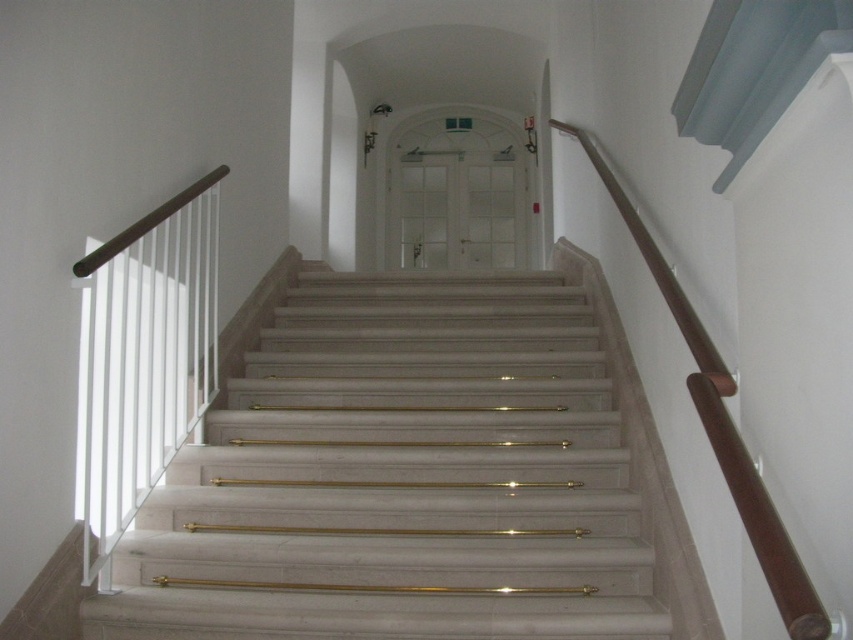
Question: Where is white marble stairs at center located in relation to brown polished wood handrail at upper right in the image?

Choices:
 (A) below
 (B) above

Answer: (A)

Question: Which point is closer to the camera taking this photo?

Choices:
 (A) (498, 440)
 (B) (711, 355)

Answer: (B)

Question: Which of the following is the closest to the observer?

Choices:
 (A) white marble stairs at center
 (B) brown polished wood handrail at upper right

Answer: (B)

Question: Does white marble stairs at center appear on the right side of brown polished wood handrail at upper right?

Choices:
 (A) yes
 (B) no

Answer: (B)

Question: Is white marble stairs at center positioned in front of brown polished wood handrail at upper right?

Choices:
 (A) no
 (B) yes

Answer: (A)

Question: Which point is closer to the camera?

Choices:
 (A) white marble stairs at center
 (B) brown polished wood handrail at upper right

Answer: (B)